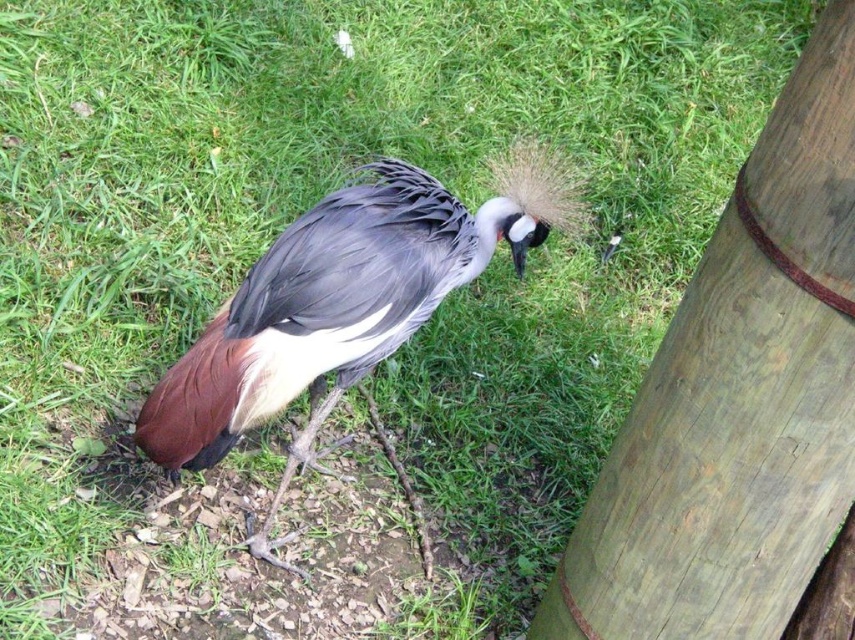
You are a photographer trying to capture the brown feathered bird at center and the wooden pole at right in the same frame. Based on their sizes, which object will appear larger in your photo?

The brown feathered bird at center will appear larger in the photo because the wooden pole at right is much taller, meaning the bird is closer to the camera and thus appears bigger.

You are a park maintenance worker who needs to replace a sign attached to the wooden pole at right. The sign you have is as wide as the brown feathered bird at center. Will the sign fit on the pole without needing adjustments?

The wooden pole at right is narrower than the brown feathered bird at center. Since the sign is as wide as the bird, it will be too wide for the pole and won

You are a photographer trying to capture a clear photo of the brown feathered bird at center. However, there is a wooden pole at right in the way. Can you move the pole to the side so that it doesn

The wooden pole at right is in front of the brown feathered bird at center, so moving it would allow you to see the bird clearly.